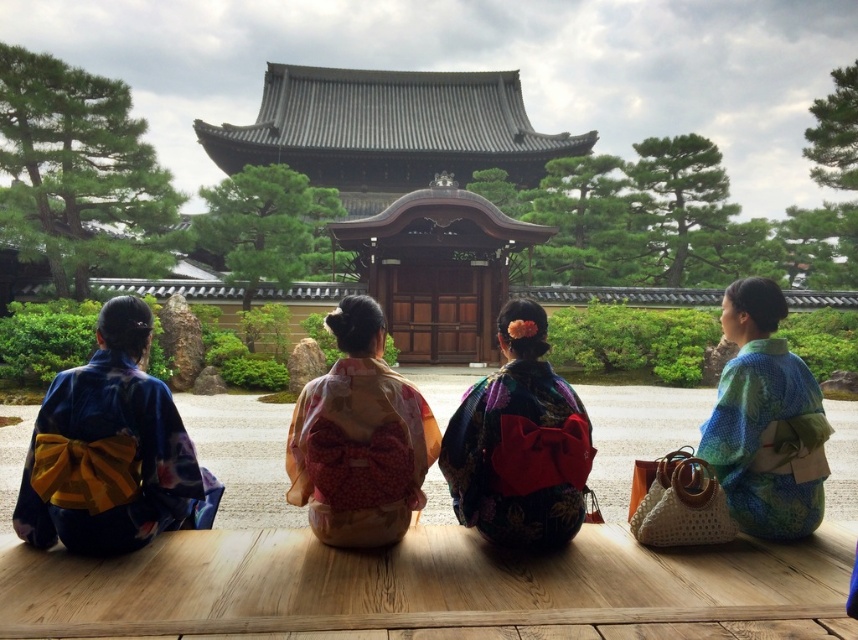
Question: Does wooden picnic table at center have a larger size compared to matte pink kimono at center?

Choices:
 (A) no
 (B) yes

Answer: (A)

Question: Which object appears farthest from the camera in this image?

Choices:
 (A) wooden picnic table at center
 (B) matte blue kimono at left
 (C) silky floral kimono at center
 (D) blue-green silk kimono at right

Answer: (D)

Question: Is matte blue kimono at left above matte pink kimono at center?

Choices:
 (A) no
 (B) yes

Answer: (A)

Question: Which object appears closest to the camera in this image?

Choices:
 (A) silky floral kimono at center
 (B) blue-green silk kimono at right
 (C) matte blue kimono at left

Answer: (C)

Question: Among these points, which one is nearest to the camera?

Choices:
 (A) (88, 387)
 (B) (304, 426)
 (C) (780, 476)

Answer: (A)

Question: Does matte blue kimono at left appear on the right side of silky floral kimono at center?

Choices:
 (A) yes
 (B) no

Answer: (B)